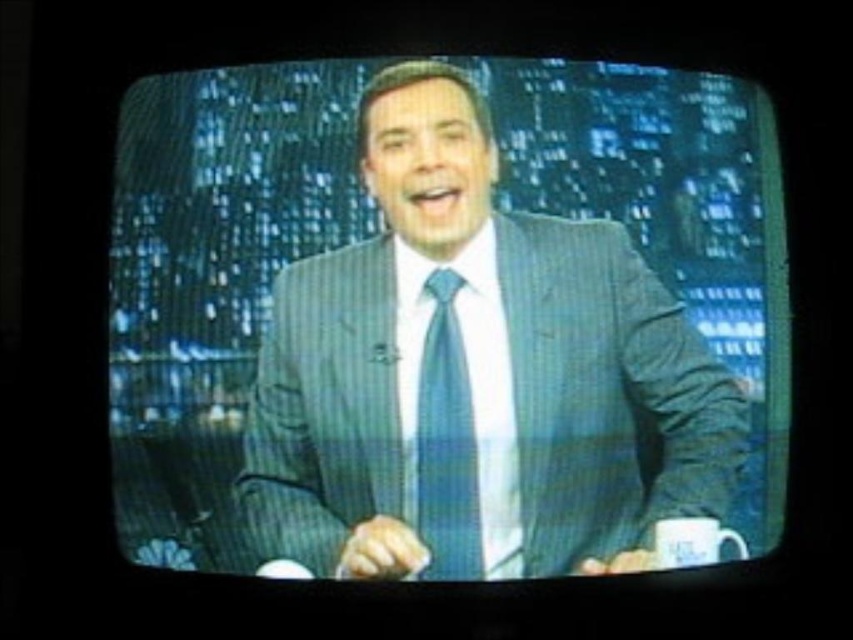
Question: Can you confirm if blue pinstripe suit at center is thinner than blue textured tie at center?

Choices:
 (A) no
 (B) yes

Answer: (A)

Question: Which object is farther from the camera taking this photo?

Choices:
 (A) blue textured tie at center
 (B) blue pinstripe suit at center

Answer: (A)

Question: Among these objects, which one is nearest to the camera?

Choices:
 (A) blue pinstripe suit at center
 (B) blue textured tie at center

Answer: (A)

Question: Where is blue pinstripe suit at center located in relation to blue textured tie at center in the image?

Choices:
 (A) above
 (B) below

Answer: (A)

Question: Can you confirm if blue pinstripe suit at center is smaller than blue textured tie at center?

Choices:
 (A) no
 (B) yes

Answer: (A)

Question: Which of the following is the closest to the observer?

Choices:
 (A) (415, 512)
 (B) (479, 573)

Answer: (B)